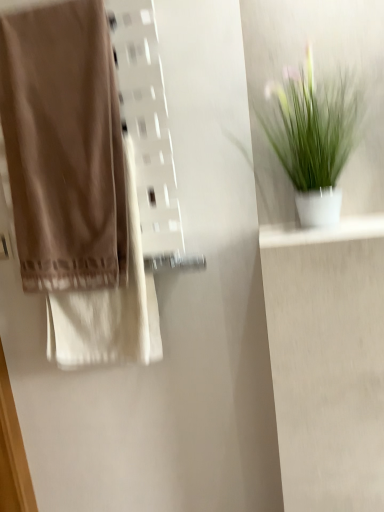
This screenshot has height=512, width=384. What are the coordinates of `matte brown towel at left` in the screenshot? It's located at (64, 147).

Based on the photo, in order to face green matte plant at upper right, should I rotate leftwards or rightwards?

Turn right approximately 16.055 degrees to face it.

What do you see at coordinates (323, 232) in the screenshot?
I see `white glossy shelf at upper right` at bounding box center [323, 232].

Identify the location of white glossy shelf at upper right. (323, 232).

This screenshot has width=384, height=512. Find the location of `matte brown towel at left`. matte brown towel at left is located at coordinates (64, 147).

Does matte brown towel at left have a larger size compared to green matte plant at upper right?

Correct, matte brown towel at left is larger in size than green matte plant at upper right.

Can you tell me how much matte brown towel at left and green matte plant at upper right differ in facing direction?

The facing directions of matte brown towel at left and green matte plant at upper right are 1.23 degrees apart.

Between matte brown towel at left and green matte plant at upper right, which one appears on the right side from the viewer's perspective?

Positioned to the right is green matte plant at upper right.

Which is in front, matte brown towel at left or white glossy shelf at upper right?

white glossy shelf at upper right is closer to the camera.

From the image's perspective, does matte brown towel at left appear lower than white glossy shelf at upper right?

No, from the image's perspective, matte brown towel at left is not beneath white glossy shelf at upper right.

Is white glossy shelf at upper right at the back of matte brown towel at left?

matte brown towel at left does not have its back to white glossy shelf at upper right.

How many degrees apart are the facing directions of matte brown towel at left and white glossy shelf at upper right?

matte brown towel at left and white glossy shelf at upper right are facing 2.08 degrees away from each other.

Which of these two, white glossy shelf at upper right or green matte plant at upper right, is thinner?

green matte plant at upper right.

Is white glossy shelf at upper right positioned with its back to green matte plant at upper right?

That's not correct — white glossy shelf at upper right is not looking away from green matte plant at upper right.

From a real-world perspective, is white glossy shelf at upper right positioned over green matte plant at upper right based on gravity?

Actually, white glossy shelf at upper right is physically below green matte plant at upper right in the real world.

Would you consider white glossy shelf at upper right to be distant from green matte plant at upper right?

No, white glossy shelf at upper right is not far away from green matte plant at upper right.

In the image, is green matte plant at upper right on the left side or the right side of white glossy shelf at upper right?

green matte plant at upper right is to the left of white glossy shelf at upper right.

Is white glossy shelf at upper right at the back of green matte plant at upper right?

No, green matte plant at upper right is not facing away from white glossy shelf at upper right.

Is green matte plant at upper right bigger than white glossy shelf at upper right?

Yes, green matte plant at upper right is bigger than white glossy shelf at upper right.

From the image's perspective, is green matte plant at upper right positioned above or below white glossy shelf at upper right?

Clearly, from the image's perspective, green matte plant at upper right is above white glossy shelf at upper right.

Is point (290, 108) closer or farther from the camera than point (78, 181)?

Point (290, 108) appears to be closer to the viewer than point (78, 181).

Does green matte plant at upper right have a lesser height compared to matte brown towel at left?

Yes.

Is there a large distance between green matte plant at upper right and matte brown towel at left?

That's not correct — green matte plant at upper right is a little close to matte brown towel at left.

Which is more to the right, white glossy shelf at upper right or matte brown towel at left?

white glossy shelf at upper right.

Does white glossy shelf at upper right have a greater height compared to matte brown towel at left?

Incorrect, the height of white glossy shelf at upper right is not larger of that of matte brown towel at left.

Is white glossy shelf at upper right bigger or smaller than matte brown towel at left?

In the image, white glossy shelf at upper right appears to be smaller than matte brown towel at left.

Is white glossy shelf at upper right oriented towards matte brown towel at left?

No.

Where is `towel below the green matte plant at upper right (from the image's perspective)`? This screenshot has width=384, height=512. towel below the green matte plant at upper right (from the image's perspective) is located at coordinates (64, 147).

The height and width of the screenshot is (512, 384). I want to click on towel above the white glossy shelf at upper right (from the image's perspective), so (x=64, y=147).

Based on their spatial positions, is white glossy shelf at upper right or green matte plant at upper right further from matte brown towel at left?

white glossy shelf at upper right lies further to matte brown towel at left than the other object.

When comparing their distances from matte brown towel at left, does green matte plant at upper right or white glossy shelf at upper right seem closer?

green matte plant at upper right is positioned closer to the anchor matte brown towel at left.

Considering their positions, is matte brown towel at left positioned further to green matte plant at upper right than white glossy shelf at upper right?

Among the two, matte brown towel at left is located further to green matte plant at upper right.

Based on the photo, looking at the image, which one is located further to white glossy shelf at upper right, matte brown towel at left or green matte plant at upper right?

Based on the image, matte brown towel at left appears to be further to white glossy shelf at upper right.

When comparing their distances from green matte plant at upper right, does white glossy shelf at upper right or matte brown towel at left seem further?

The object further to green matte plant at upper right is matte brown towel at left.

Looking at this image, based on their spatial positions, is green matte plant at upper right or matte brown towel at left closer to white glossy shelf at upper right?

green matte plant at upper right is closer to white glossy shelf at upper right.

Identify the location of houseplant situated between matte brown towel at left and white glossy shelf at upper right from left to right. The image size is (384, 512). click(313, 137).